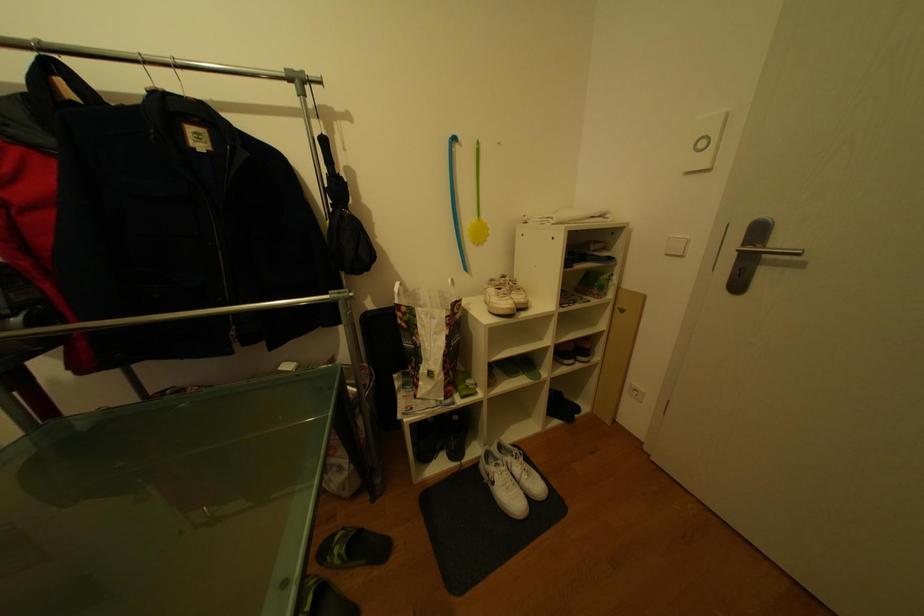
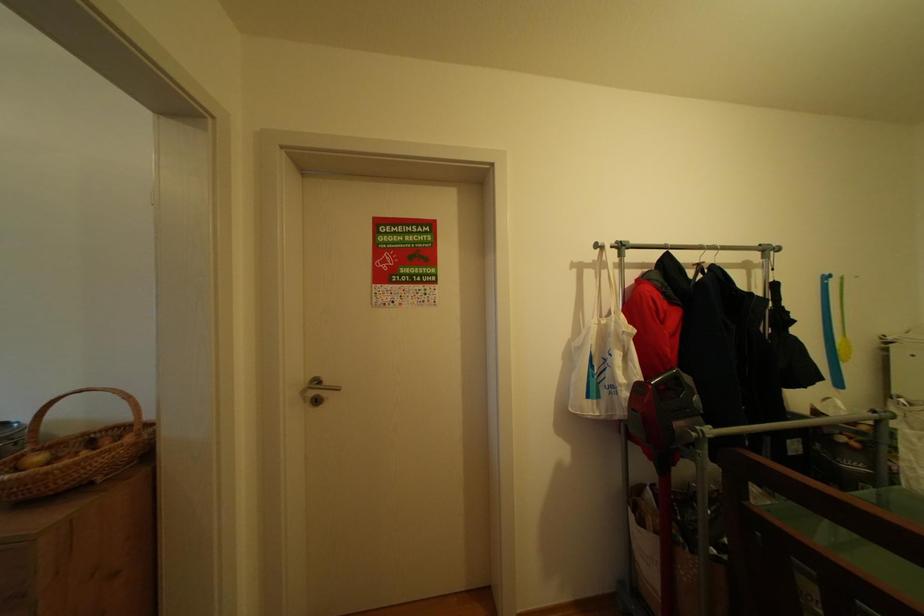
Question: The images are taken continuously from a first-person perspective. In which direction are you moving?

Choices:
 (A) Left
 (B) Right
 (C) Forward
 (D) Backward

Answer: (A)